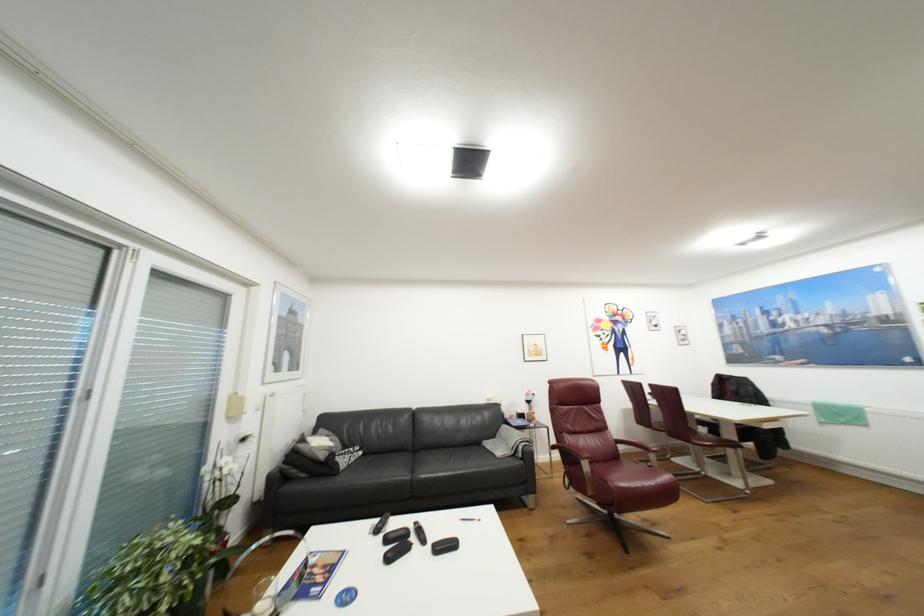
The width and height of the screenshot is (924, 616). In order to click on black sofa armrest in this screenshot , I will do `click(513, 438)`.